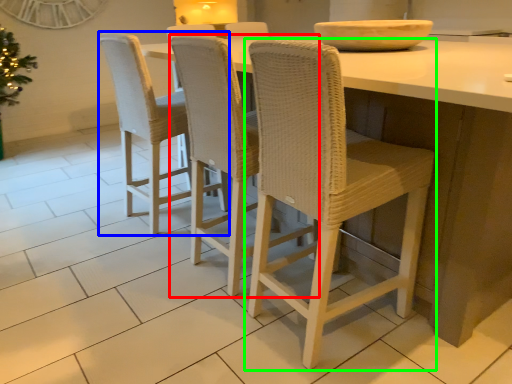
Question: Estimate the real-world distances between objects in this image. Which object is farther from chair (highlighted by a red box), chair (highlighted by a blue box) or chair (highlighted by a green box)?

Choices:
 (A) chair
 (B) chair

Answer: (A)